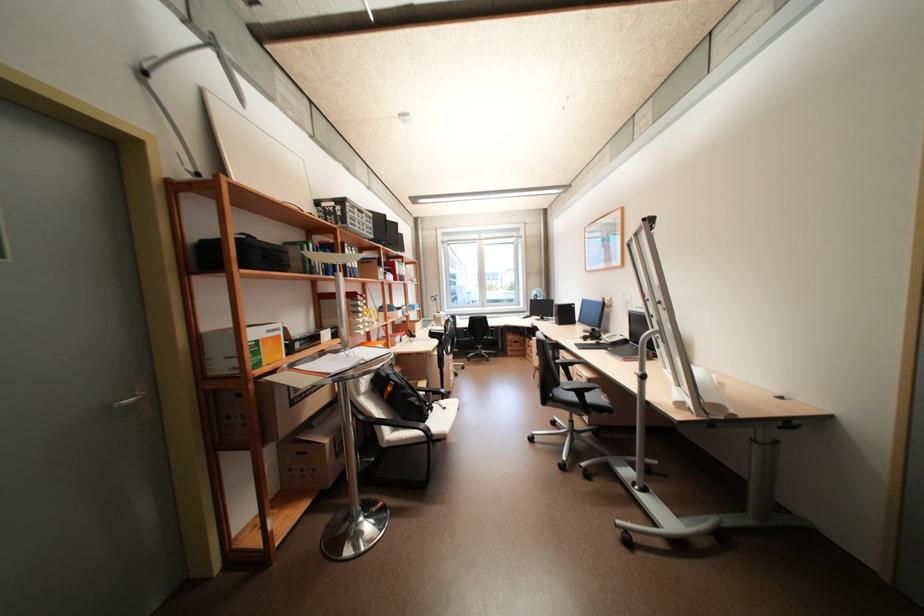
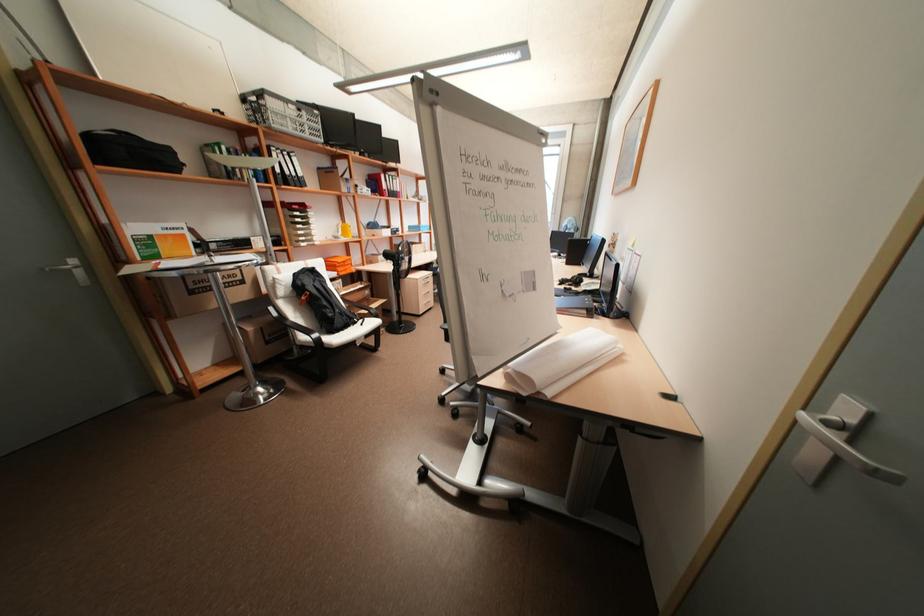
In the second image, find the point that corresponds to point (246, 267) in the first image.

(102, 163)